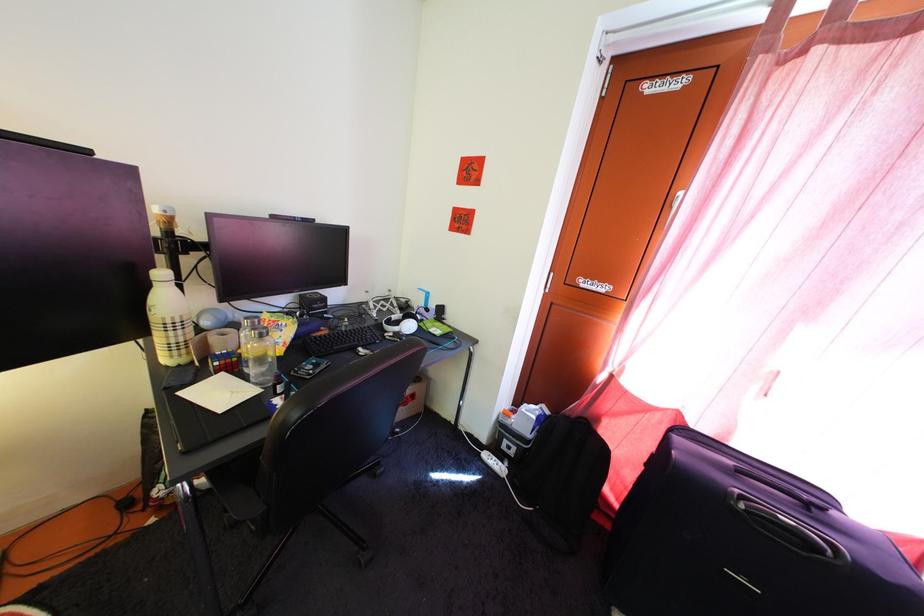
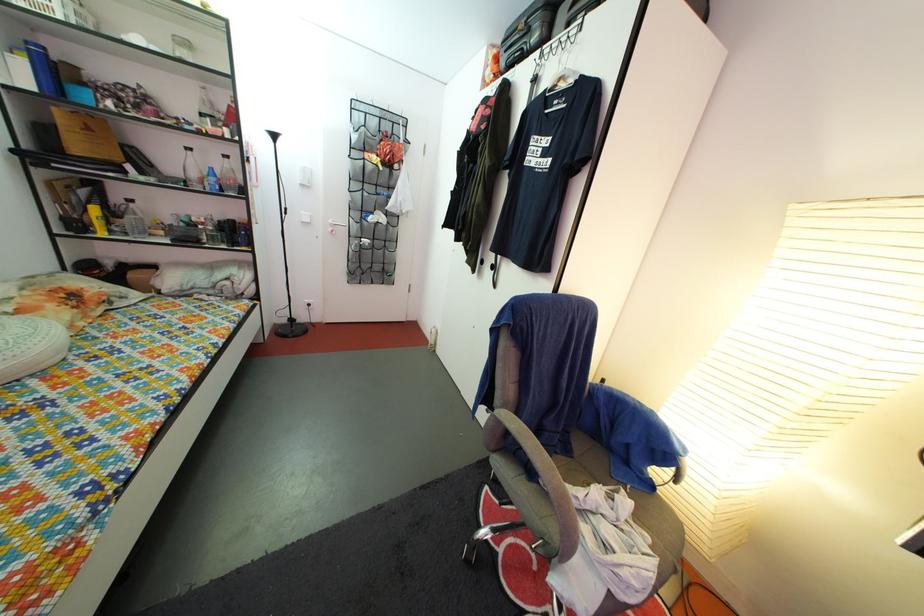
The images are taken continuously from a first-person perspective. In which direction is your viewpoint rotating?

The camera's rotation is toward left-down.